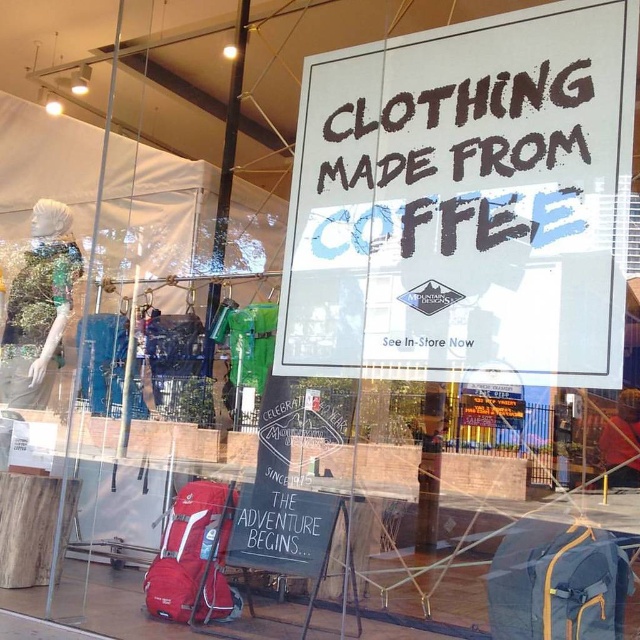
You are a customer standing in front of the Mountain Designs storefront window. You see a white paper sign at center and a matte blue backpack at lower right. Which object is positioned closer to you?

The white paper sign at center is closer to the viewer than the matte blue backpack at lower right.

You are standing in front of the Mountain Designs storefront window. You notice two points marked on the window display. The first point is at coordinates point (376, 365), and the second is at point (208, 483). Which point is closer to your eyes?

Point (376, 365) is closer to the camera than point (208, 483).

You are a customer looking at the Mountain Designs storefront window display. You see a matte blue backpack at lower right and a matte red backpack at lower left. Which backpack is closer to you?

The matte blue backpack at lower right is closer to you because it is in front of the matte red backpack at lower left.